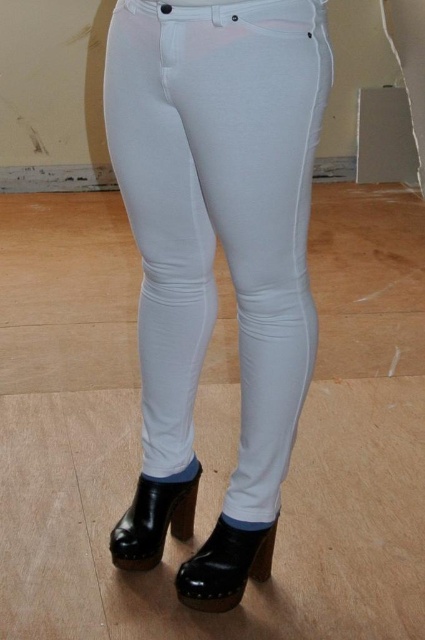
You are a fashion designer trying to create a new outfit. You have the white smooth pants at center and the glossy patent leather boot at lower center in your design. Which item is wider in terms of their width?

The white smooth pants at center is wider than the glossy patent leather boot at lower center according to the description.

You are a photographer setting up a shoot in an indoor studio. You have two boots in the scene, a glossy patent leather boot at lower center and a black leather boot at lower center. The client wants to know which boot is positioned to the right side of the other. Can you determine this?

The glossy patent leather boot at lower center is positioned to the right of the black leather boot at lower center according to the description.

You are a photographer setting up a shoot in the described scene. You need to place a small prop between the glossy patent leather boot at lower center and the black leather boot at lower center. Based on their positions, where should you place the prop?

The glossy patent leather boot at lower center is located below the black leather boot at lower center. Therefore, you should place the prop between them by positioning it just above the glossy patent leather boot at lower center and below the black leather boot at lower center to ensure it sits between their vertical positions.